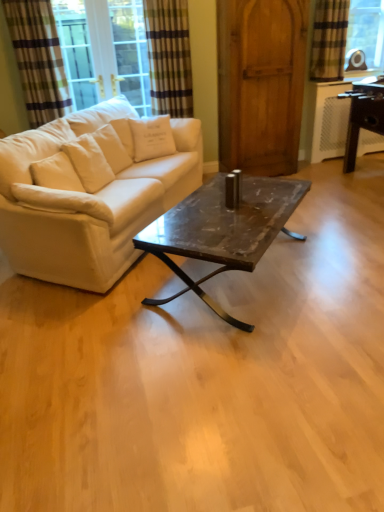
Question: From a real-world perspective, does striped fabric curtain at upper left, which appears as the first curtain when viewed from the left, sit lower than wooden barn door at center?

Choices:
 (A) no
 (B) yes

Answer: (A)

Question: From the image's perspective, is striped fabric curtain at upper left, which appears as the 3th curtain when viewed from the right, below wooden barn door at center?

Choices:
 (A) no
 (B) yes

Answer: (A)

Question: Considering the relative sizes of striped fabric curtain at upper left, which appears as the 3th curtain when viewed from the right, and wooden barn door at center in the image provided, is striped fabric curtain at upper left, which appears as the 3th curtain when viewed from the right, smaller than wooden barn door at center?

Choices:
 (A) yes
 (B) no

Answer: (A)

Question: Considering the relative sizes of striped fabric curtain at upper left, which appears as the 3th curtain when viewed from the right, and wooden barn door at center in the image provided, is striped fabric curtain at upper left, which appears as the 3th curtain when viewed from the right, thinner than wooden barn door at center?

Choices:
 (A) yes
 (B) no

Answer: (A)

Question: Would you say striped fabric curtain at upper left, which appears as the first curtain when viewed from the left, is outside wooden barn door at center?

Choices:
 (A) yes
 (B) no

Answer: (A)

Question: Looking at the image, does plaid fabric curtain at upper right, which is the 1th curtain from right to left, seem bigger or smaller compared to wooden barn door at center?

Choices:
 (A) small
 (B) big

Answer: (A)

Question: Considering the positions of point (337, 4) and point (244, 138), is point (337, 4) closer or farther from the camera than point (244, 138)?

Choices:
 (A) farther
 (B) closer

Answer: (B)

Question: From the image's perspective, relative to wooden barn door at center, is plaid fabric curtain at upper right, which is the 1th curtain from right to left, above or below?

Choices:
 (A) below
 (B) above

Answer: (B)

Question: Is plaid fabric curtain at upper right, which is the 1th curtain from right to left, taller or shorter than wooden barn door at center?

Choices:
 (A) tall
 (B) short

Answer: (B)

Question: Based on their sizes in the image, would you say plaid fabric curtain at upper right, which is the 1th curtain from right to left, is bigger or smaller than marble/black metal coffee table at center?

Choices:
 (A) big
 (B) small

Answer: (B)

Question: Considering the positions of plaid fabric curtain at upper right, which is the 1th curtain from right to left, and marble/black metal coffee table at center in the image, is plaid fabric curtain at upper right, which is the 1th curtain from right to left, wider or thinner than marble/black metal coffee table at center?

Choices:
 (A) thin
 (B) wide

Answer: (A)

Question: Would you say plaid fabric curtain at upper right, arranged as the third curtain when viewed from the left, is to the left or to the right of marble/black metal coffee table at center in the picture?

Choices:
 (A) right
 (B) left

Answer: (A)

Question: Is plaid fabric curtain at upper right, arranged as the third curtain when viewed from the left, inside the boundaries of marble/black metal coffee table at center, or outside?

Choices:
 (A) inside
 (B) outside

Answer: (B)

Question: Relative to white cotton pillow at upper left, positioned as the second pillow in bottom-to-top order, is marble/black metal coffee table at center in front or behind?

Choices:
 (A) behind
 (B) front

Answer: (B)

Question: Is marble/black metal coffee table at center inside or outside of white cotton pillow at upper left, which is counted as the first pillow, starting from the top?

Choices:
 (A) inside
 (B) outside

Answer: (B)